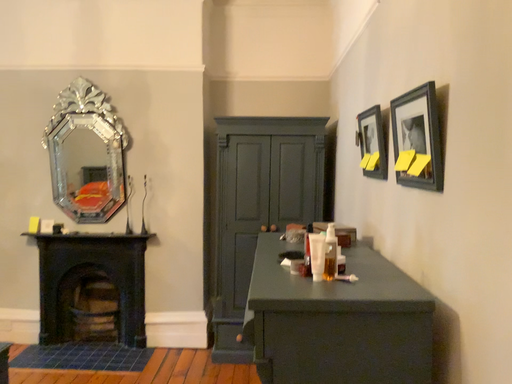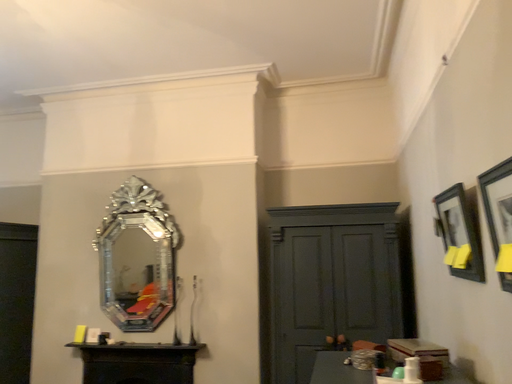
Question: How did the camera likely rotate when shooting the video?

Choices:
 (A) rotated upward
 (B) rotated downward

Answer: (A)